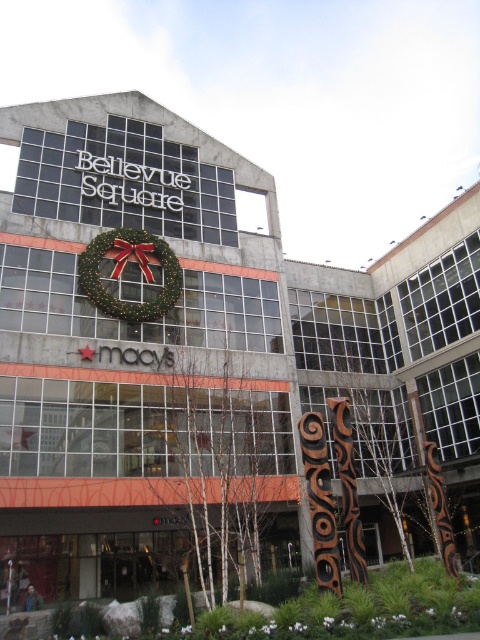
Based on the photo, you are a visitor at Bellevue Square and want to take a photo of both the brown carved wood totem pole at center and the green matte wreath at center. Since you want both to be clearly visible in the frame, which object should you focus on to ensure both are in focus?

The brown carved wood totem pole at center has a larger size compared to the green matte wreath at center, so you should focus on the brown carved wood totem pole at center to ensure both are in focus.

You are a delivery person who needs to place a new 10 feet long banner between the brown carved wood totem pole at center and the green matte wreath at center. Can you fit the banner between them without bending it?

The brown carved wood totem pole at center and green matte wreath at center are 75.46 feet apart from each other, so yes, the 10 feet long banner can be placed between them without bending since the distance is sufficient.

You are a visitor standing in front of Bellevue Square and see the brown carved wood totem pole at center and the green matte wreath at center. Which object is located higher up?

The green matte wreath at center is higher up because the brown carved wood totem pole at center is positioned under it.